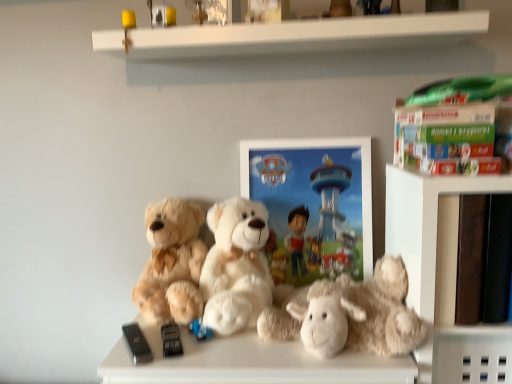
Question: From a real-world perspective, is smooth brown bookshelf at right positioned under white plush teddy bear at center, the 2th teddy bear in the right-to-left sequence, based on gravity?

Choices:
 (A) no
 (B) yes

Answer: (A)

Question: Considering the relative sizes of smooth brown bookshelf at right and white plush teddy bear at center, the 2th teddy bear in the right-to-left sequence, in the image provided, is smooth brown bookshelf at right wider than white plush teddy bear at center, the 2th teddy bear in the right-to-left sequence,?

Choices:
 (A) yes
 (B) no

Answer: (A)

Question: Is smooth brown bookshelf at right outside white plush teddy bear at center, the 2th teddy bear in the right-to-left sequence?

Choices:
 (A) no
 (B) yes

Answer: (B)

Question: Is smooth brown bookshelf at right to the left of white plush teddy bear at center, the 2th teddy bear in the right-to-left sequence, from the viewer's perspective?

Choices:
 (A) no
 (B) yes

Answer: (A)

Question: Does smooth brown bookshelf at right come behind white plush teddy bear at center, the 2th teddy bear in the right-to-left sequence?

Choices:
 (A) yes
 (B) no

Answer: (B)

Question: Would you say white plush teddy bear at center, which appears as the second teddy bear when viewed from the left, is inside or outside black matte remote control at lower left, the 1th toy from the bottom?

Choices:
 (A) inside
 (B) outside

Answer: (B)

Question: Is white plush teddy bear at center, the 2th teddy bear in the right-to-left sequence, bigger or smaller than black matte remote control at lower left, the 3th toy when ordered from top to bottom?

Choices:
 (A) big
 (B) small

Answer: (A)

Question: In the image, is white plush teddy bear at center, the 2th teddy bear in the right-to-left sequence, positioned in front of or behind black matte remote control at lower left, the 1th toy from the bottom?

Choices:
 (A) behind
 (B) front

Answer: (A)

Question: From a real-world perspective, is white plush teddy bear at center, which appears as the second teddy bear when viewed from the left, physically located above or below black matte remote control at lower left, the 3th toy when ordered from top to bottom?

Choices:
 (A) above
 (B) below

Answer: (A)

Question: Relative to smooth brown bookshelf at right, is white plush teddy bear at center, which appears as the second teddy bear when viewed from the left, in front or behind?

Choices:
 (A) front
 (B) behind

Answer: (B)

Question: From the image's perspective, is white plush teddy bear at center, which appears as the second teddy bear when viewed from the left, located above or below smooth brown bookshelf at right?

Choices:
 (A) above
 (B) below

Answer: (B)

Question: Considering the positions of white plush teddy bear at center, the 2th teddy bear in the right-to-left sequence, and smooth brown bookshelf at right in the image, is white plush teddy bear at center, the 2th teddy bear in the right-to-left sequence, taller or shorter than smooth brown bookshelf at right?

Choices:
 (A) tall
 (B) short

Answer: (A)

Question: Looking at the image, does white plush teddy bear at center, the 2th teddy bear in the right-to-left sequence, seem bigger or smaller compared to smooth brown bookshelf at right?

Choices:
 (A) small
 (B) big

Answer: (A)

Question: In the image, is metallic silver toy at upper center, which appears as the third toy when ordered from the bottom, positioned in front of or behind fuzzy beige teddy bear at left, the first teddy bear in the left-to-right sequence?

Choices:
 (A) front
 (B) behind

Answer: (A)

Question: Considering the positions of point (164, 26) and point (159, 261), is point (164, 26) closer or farther from the camera than point (159, 261)?

Choices:
 (A) farther
 (B) closer

Answer: (B)